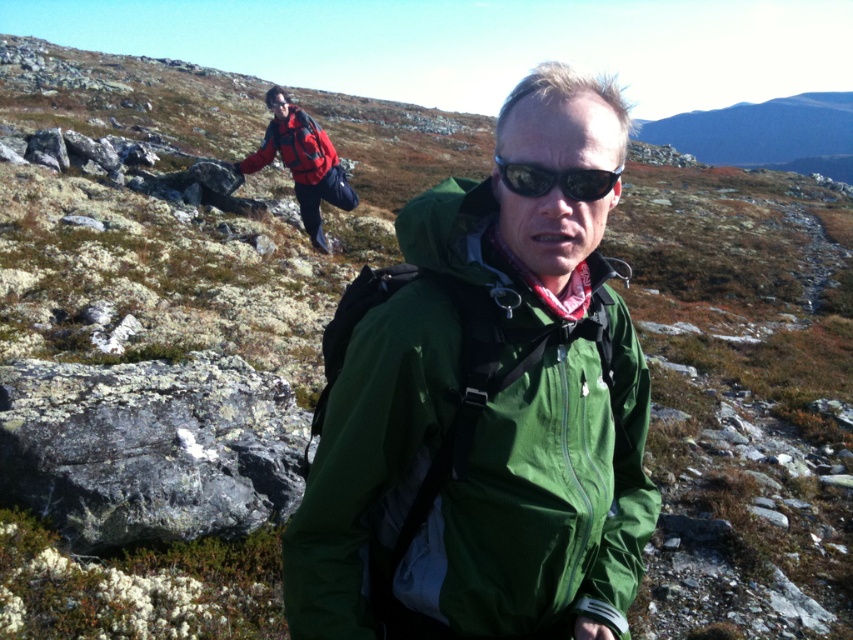
Question: Which object is closer to the camera taking this photo?

Choices:
 (A) green fabric jacket at center
 (B) sunglasses at center

Answer: (B)

Question: Which of the following is the farthest from the observer?

Choices:
 (A) (320, 134)
 (B) (531, 173)
 (C) (560, 332)

Answer: (A)

Question: Is the position of matte red jacket at upper left less distant than that of red fleece jacket at upper left?

Choices:
 (A) no
 (B) yes

Answer: (A)

Question: Is green fabric jacket at center positioned at the back of matte red jacket at upper left?

Choices:
 (A) no
 (B) yes

Answer: (A)

Question: Can you confirm if matte red jacket at upper left is thinner than sunglasses at center?

Choices:
 (A) no
 (B) yes

Answer: (A)

Question: Which is farther from the red fleece jacket at upper left?

Choices:
 (A) sunglasses at center
 (B) green fabric jacket at center

Answer: (A)